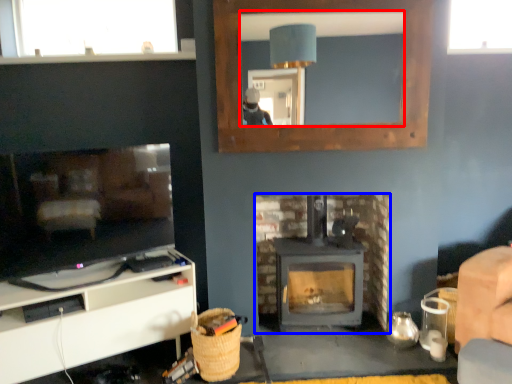
Question: Among these objects, which one is nearest to the camera, mirror (highlighted by a red box) or fireplace (highlighted by a blue box)?

Choices:
 (A) mirror
 (B) fireplace

Answer: (A)